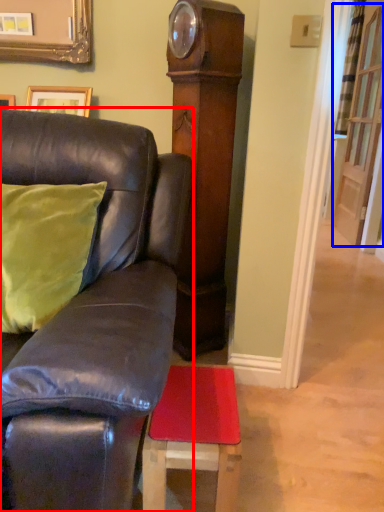
Question: Which object is closer to the camera taking this photo, furniture (highlighted by a red box) or glass door (highlighted by a blue box)?

Choices:
 (A) furniture
 (B) glass door

Answer: (A)